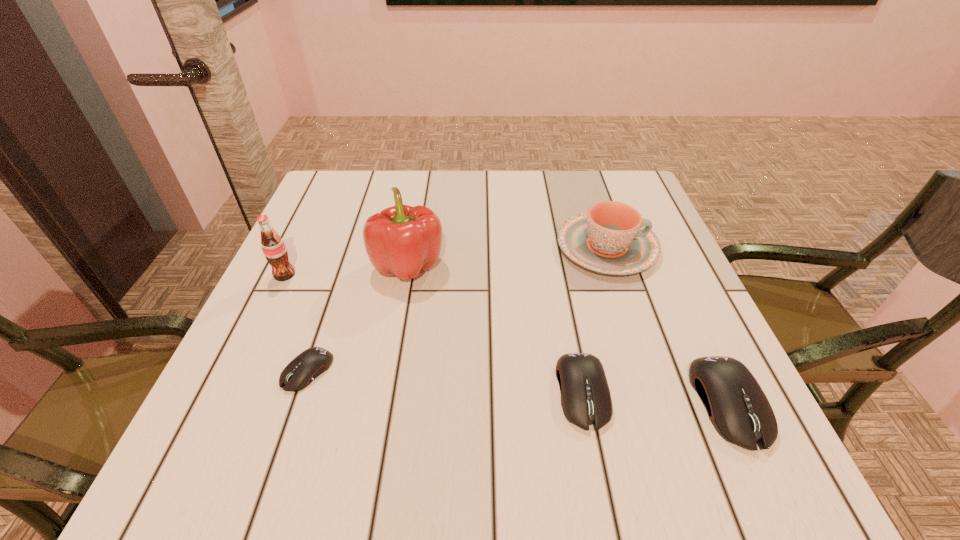
Identify the location of vacant position in the image that satisfies the following two spatial constraints: 1. on the front side of the second computer equipment from right to left; 2. on the right side of the leftmost object. The image size is (960, 540). click(228, 392).

The width and height of the screenshot is (960, 540). I want to click on free space that satisfies the following two spatial constraints: 1. on the front side of the second tallest computer equipment; 2. on the right side of the leftmost object, so click(x=228, y=392).

Where is `free space that satisfies the following two spatial constraints: 1. on the handle side of the third tallest object; 2. on the right side of the rightmost computer equipment`? free space that satisfies the following two spatial constraints: 1. on the handle side of the third tallest object; 2. on the right side of the rightmost computer equipment is located at coordinates (659, 403).

Where is `vacant area that satisfies the following two spatial constraints: 1. on the handle side of the chinaware; 2. on the right side of the rightmost computer equipment`? The image size is (960, 540). vacant area that satisfies the following two spatial constraints: 1. on the handle side of the chinaware; 2. on the right side of the rightmost computer equipment is located at coordinates (659, 403).